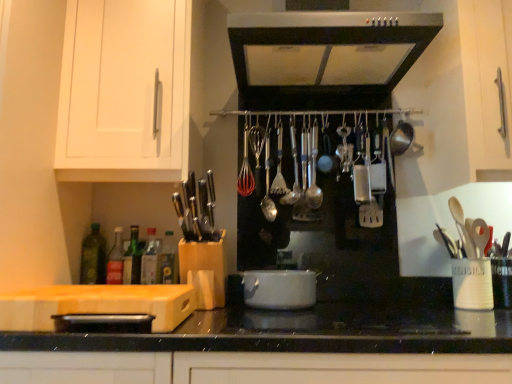
Locate an element on the screen. The width and height of the screenshot is (512, 384). green glass bottle at lower left, marked as the 3th bottle in a right-to-left arrangement is located at coordinates (132, 258).

The height and width of the screenshot is (384, 512). Describe the element at coordinates (313, 171) in the screenshot. I see `satin silver spoon at center, placed as the 1th utensil when sorted from right to left` at that location.

The image size is (512, 384). Describe the element at coordinates (125, 92) in the screenshot. I see `white matte cabinet at upper left` at that location.

The height and width of the screenshot is (384, 512). I want to click on white matte cabinet at upper left, so click(x=125, y=92).

Find the location of a particular element. The height and width of the screenshot is (384, 512). translucent glass bottle at lower left, acting as the second bottle starting from the right is located at coordinates [150, 258].

What do you see at coordinates (293, 169) in the screenshot? Image resolution: width=512 pixels, height=384 pixels. I see `polished silver spoon at center, which is the 2th utensil from left to right` at bounding box center [293, 169].

The image size is (512, 384). I want to click on white glossy pot at center, so click(x=279, y=289).

Is translucent glass bottle at left, placed as the second bottle when sorted from left to right, closer to camera compared to silver metallic spoon at center, which appears as the 3th utensil when viewed from the right?

Yes, it is.

Can you confirm if translucent glass bottle at left, placed as the second bottle when sorted from left to right, is positioned to the left of silver metallic spoon at center, placed as the 1th utensil when sorted from left to right?

Indeed, translucent glass bottle at left, placed as the second bottle when sorted from left to right, is positioned on the left side of silver metallic spoon at center, placed as the 1th utensil when sorted from left to right.

From a real-world perspective, is translucent glass bottle at left, placed as the second bottle when sorted from left to right, below silver metallic spoon at center, placed as the 1th utensil when sorted from left to right?

Yes.

Is translucent glass bottle at left, the fourth bottle when ordered from right to left, taller or shorter than silver metallic spoon at center, placed as the 1th utensil when sorted from left to right?

Considering their sizes, translucent glass bottle at left, the fourth bottle when ordered from right to left, has less height than silver metallic spoon at center, placed as the 1th utensil when sorted from left to right.

You are a GUI agent. You are given a task and a screenshot of the screen. Output one action in this format:
    pyautogui.click(x=<x>, y=<y>)
    Task: Click on the 5th bottle positioned below the satin silver spoon at center, which appears as the 3th utensil when viewed from the left (from the image's perspective)
    The width and height of the screenshot is (512, 384).
    Given the screenshot: What is the action you would take?
    (x=150, y=258)

Is translucent glass bottle at lower left, which is the fourth bottle in left-to-right order, at the back of satin silver spoon at center, placed as the 1th utensil when sorted from right to left?

No, satin silver spoon at center, placed as the 1th utensil when sorted from right to left,'s orientation is not away from translucent glass bottle at lower left, which is the fourth bottle in left-to-right order.

How far apart are satin silver spoon at center, placed as the 1th utensil when sorted from right to left, and translucent glass bottle at lower left, acting as the second bottle starting from the right?

62.48 centimeters.

Based on their positions, is satin silver spoon at center, which appears as the 3th utensil when viewed from the left, located to the left or right of translucent glass bottle at lower left, acting as the second bottle starting from the right?

satin silver spoon at center, which appears as the 3th utensil when viewed from the left, is positioned on translucent glass bottle at lower left, acting as the second bottle starting from the right,'s right side.

Considering the relative sizes of satin silver spoon at center, which appears as the 3th utensil when viewed from the left, and translucent glass bottle at left, the fourth bottle when ordered from right to left, in the image provided, is satin silver spoon at center, which appears as the 3th utensil when viewed from the left, bigger than translucent glass bottle at left, the fourth bottle when ordered from right to left,?

No, satin silver spoon at center, which appears as the 3th utensil when viewed from the left, is not bigger than translucent glass bottle at left, the fourth bottle when ordered from right to left.

From their relative heights in the image, would you say satin silver spoon at center, placed as the 1th utensil when sorted from right to left, is taller or shorter than translucent glass bottle at left, the fourth bottle when ordered from right to left?

Considering their sizes, satin silver spoon at center, placed as the 1th utensil when sorted from right to left, has more height than translucent glass bottle at left, the fourth bottle when ordered from right to left.

Does satin silver spoon at center, placed as the 1th utensil when sorted from right to left, have a greater width compared to translucent glass bottle at left, placed as the second bottle when sorted from left to right?

Incorrect, the width of satin silver spoon at center, placed as the 1th utensil when sorted from right to left, does not surpass that of translucent glass bottle at left, placed as the second bottle when sorted from left to right.

From the image's perspective, would you say green glass bottle at center, the 5th bottle in the left-to-right sequence, is positioned over white matte cabinet at upper left?

No, from the image's perspective, green glass bottle at center, the 5th bottle in the left-to-right sequence, is not on top of white matte cabinet at upper left.

Which is behind, point (175, 263) or point (165, 46)?

The point (175, 263) is behind.

Is white matte cabinet at upper left completely or partially inside green glass bottle at center, the 5th bottle in the left-to-right sequence?

No, white matte cabinet at upper left is not inside green glass bottle at center, the 5th bottle in the left-to-right sequence.

Does green glass bottle at center, the 5th bottle in the left-to-right sequence, touch white matte cabinet at upper left?

No, green glass bottle at center, the 5th bottle in the left-to-right sequence, is not in contact with white matte cabinet at upper left.

Is white glossy pot at center turned away from translucent glass bottle at lower left, which is the fourth bottle in left-to-right order?

No, white glossy pot at center is not facing the opposite direction of translucent glass bottle at lower left, which is the fourth bottle in left-to-right order.

From the image's perspective, would you say white glossy pot at center is positioned over translucent glass bottle at lower left, which is the fourth bottle in left-to-right order?

No, from the image's perspective, white glossy pot at center is not over translucent glass bottle at lower left, which is the fourth bottle in left-to-right order.

Is white glossy pot at center not close to translucent glass bottle at lower left, acting as the second bottle starting from the right?

That's not correct — white glossy pot at center is a little close to translucent glass bottle at lower left, acting as the second bottle starting from the right.

Can you confirm if satin silver range hood at upper center is shorter than green glass bottle at lower left, marked as the third bottle in a left-to-right arrangement?

No.

Is satin silver range hood at upper center outside of green glass bottle at lower left, marked as the third bottle in a left-to-right arrangement?

Yes, satin silver range hood at upper center is located beyond the bounds of green glass bottle at lower left, marked as the third bottle in a left-to-right arrangement.

Where is `utensil located above the polished silver spoon at center, which is the 2th utensil from left to right (from a real-world perspective)`? Image resolution: width=512 pixels, height=384 pixels. utensil located above the polished silver spoon at center, which is the 2th utensil from left to right (from a real-world perspective) is located at coordinates (313, 171).

Which is closer to the camera, (298,197) or (309,190)?

Point (298,197)

Would you say polished silver spoon at center, placed as the 2th utensil when sorted from right to left, contains satin silver spoon at center, placed as the 1th utensil when sorted from right to left?

Definitely not — satin silver spoon at center, placed as the 1th utensil when sorted from right to left, is not inside polished silver spoon at center, placed as the 2th utensil when sorted from right to left.

From the image's perspective, is polished silver spoon at center, which is the 2th utensil from left to right, beneath satin silver spoon at center, which appears as the 3th utensil when viewed from the left?

Actually, polished silver spoon at center, which is the 2th utensil from left to right, appears above satin silver spoon at center, which appears as the 3th utensil when viewed from the left, in the image.

Locate an element on the screen. utensil that is the 1st one when counting rightward from the translucent glass bottle at left, placed as the second bottle when sorted from left to right is located at coordinates (268, 185).

Locate an element on the screen. the 4th bottle positioned below the satin silver spoon at center, placed as the 1th utensil when sorted from right to left (from a real-world perspective) is located at coordinates (150, 258).

Based on their spatial positions, is translucent glass bottle at lower left, acting as the second bottle starting from the right, or translucent glass bottle at left, the fourth bottle when ordered from right to left, closer to polished silver spoon at center, placed as the 2th utensil when sorted from right to left?

The object closer to polished silver spoon at center, placed as the 2th utensil when sorted from right to left, is translucent glass bottle at lower left, acting as the second bottle starting from the right.

Estimate the real-world distances between objects in this image. Which object is further from green glass bottle at lower left, marked as the third bottle in a left-to-right arrangement, silver metallic spoon at center, placed as the 1th utensil when sorted from left to right, or green glass bottle at left, the 1th bottle positioned from the left?

Among the two, silver metallic spoon at center, placed as the 1th utensil when sorted from left to right, is located further to green glass bottle at lower left, marked as the third bottle in a left-to-right arrangement.

From the image, which object appears to be farther from polished silver spoon at center, placed as the 2th utensil when sorted from right to left, green glass bottle at center, the 5th bottle in the left-to-right sequence, or green glass bottle at left, the 1th bottle positioned from the left?

Among the two, green glass bottle at left, the 1th bottle positioned from the left, is located further to polished silver spoon at center, placed as the 2th utensil when sorted from right to left.

Looking at this image, when comparing their distances from green glass bottle at center, the 5th bottle in the left-to-right sequence, does translucent glass bottle at lower left, which is the fourth bottle in left-to-right order, or satin silver range hood at upper center seem further?

Among the two, satin silver range hood at upper center is located further to green glass bottle at center, the 5th bottle in the left-to-right sequence.

From the image, which object appears to be nearer to silver metallic spoon at center, placed as the 1th utensil when sorted from left to right, green glass bottle at left, the 1th bottle positioned from the left, or white glossy pot at center?

Based on the image, white glossy pot at center appears to be nearer to silver metallic spoon at center, placed as the 1th utensil when sorted from left to right.

Estimate the real-world distances between objects in this image. Which object is closer to green glass bottle at lower left, marked as the 3th bottle in a right-to-left arrangement, satin silver spoon at center, which appears as the 3th utensil when viewed from the left, or green glass bottle at center, the 5th bottle in the left-to-right sequence?

The object closer to green glass bottle at lower left, marked as the 3th bottle in a right-to-left arrangement, is green glass bottle at center, the 5th bottle in the left-to-right sequence.

From the image, which object appears to be nearer to satin silver range hood at upper center, green glass bottle at left, arranged as the fifth bottle when viewed from the right, or satin silver spoon at center, placed as the 1th utensil when sorted from right to left?

Among the two, satin silver spoon at center, placed as the 1th utensil when sorted from right to left, is located nearer to satin silver range hood at upper center.

Which object lies further to the anchor point white glossy pot at center, silver metallic spoon at center, placed as the 1th utensil when sorted from left to right, or white matte cabinet at upper left?

Among the two, white matte cabinet at upper left is located further to white glossy pot at center.

You are a GUI agent. You are given a task and a screenshot of the screen. Output one action in this format:
    pyautogui.click(x=<x>, y=<y>)
    Task: Click on the cabinetry between green glass bottle at lower left, marked as the 3th bottle in a right-to-left arrangement, and satin silver spoon at center, placed as the 1th utensil when sorted from right to left, in the horizontal direction
    This screenshot has width=512, height=384.
    Given the screenshot: What is the action you would take?
    (x=125, y=92)

This screenshot has height=384, width=512. What are the coordinates of `utensil between white matte cabinet at upper left and polished silver spoon at center, placed as the 2th utensil when sorted from right to left, from left to right` in the screenshot? It's located at (268, 185).

I want to click on cabinetry between satin silver range hood at upper center and translucent glass bottle at left, placed as the second bottle when sorted from left to right, in the vertical direction, so click(x=125, y=92).

Find the location of `bottle located between translucent glass bottle at lower left, which is the fourth bottle in left-to-right order, and white glossy pot at center in the left-right direction`. bottle located between translucent glass bottle at lower left, which is the fourth bottle in left-to-right order, and white glossy pot at center in the left-right direction is located at coordinates (168, 260).